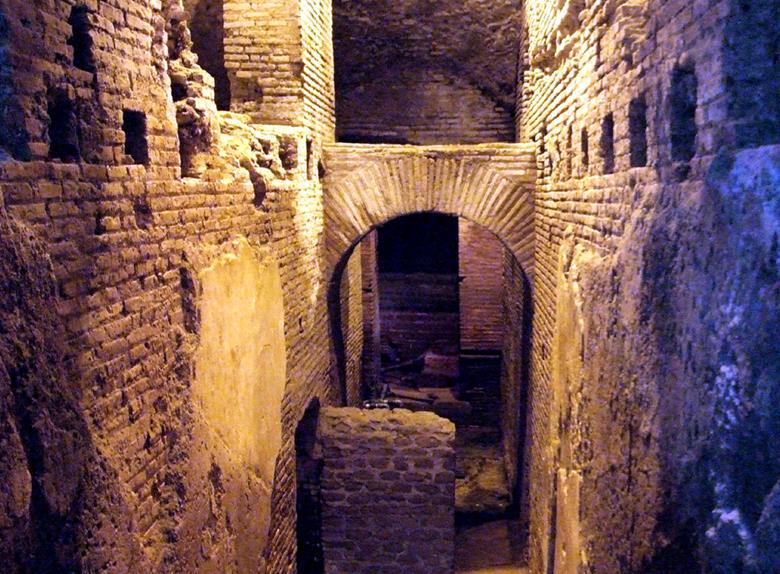
This screenshot has height=574, width=780. Find the location of `9 windows`. 9 windows is located at coordinates (757, 131).